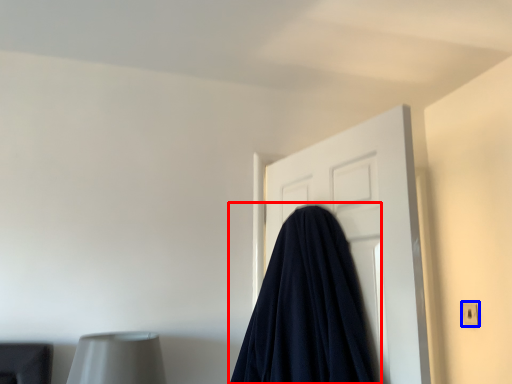
Question: Which object is closer to the camera taking this photo, blanket (highlighted by a red box) or electric outlet (highlighted by a blue box)?

Choices:
 (A) blanket
 (B) electric outlet

Answer: (A)